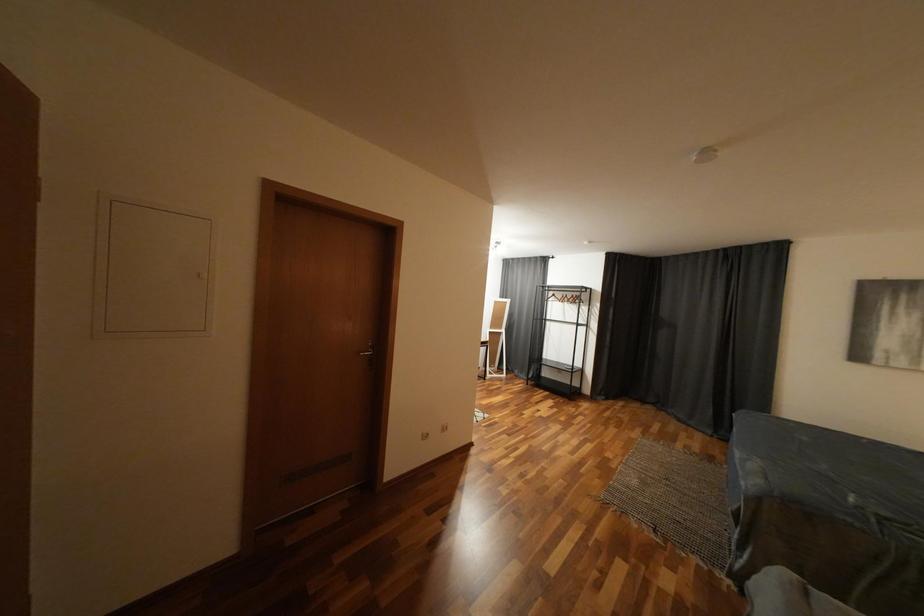
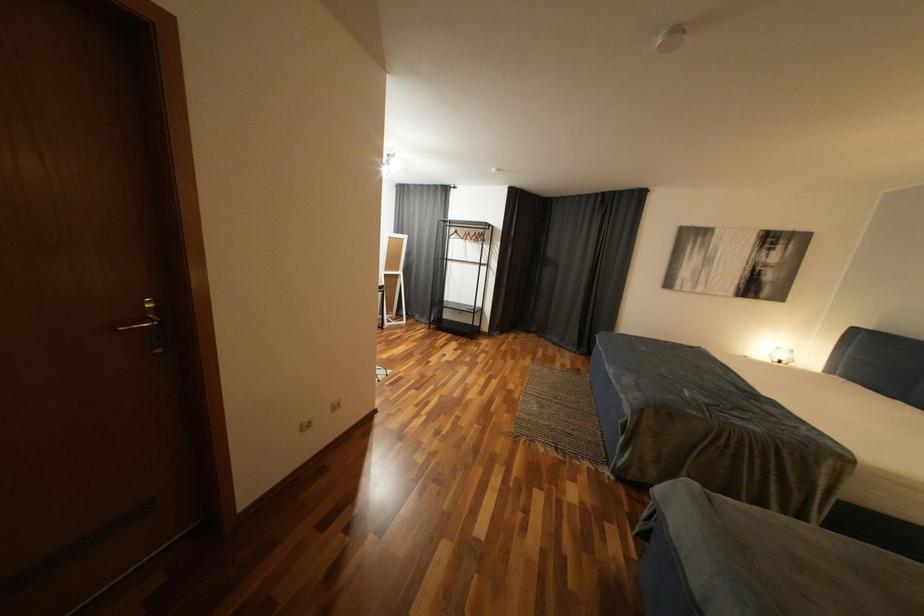
Question: Which direction would the cameraman need to move to produce the second image? Reply with the corresponding letter.

Choices:
 (A) Left
 (B) Right
 (C) Forward
 (D) Backward

Answer: (C)